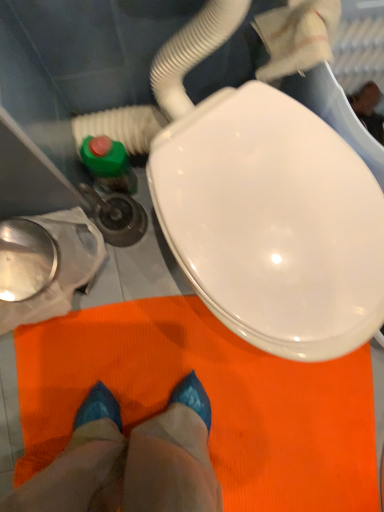
This screenshot has height=512, width=384. I want to click on free space below blue glossy shoes at center (from a real-world perspective), so click(148, 401).